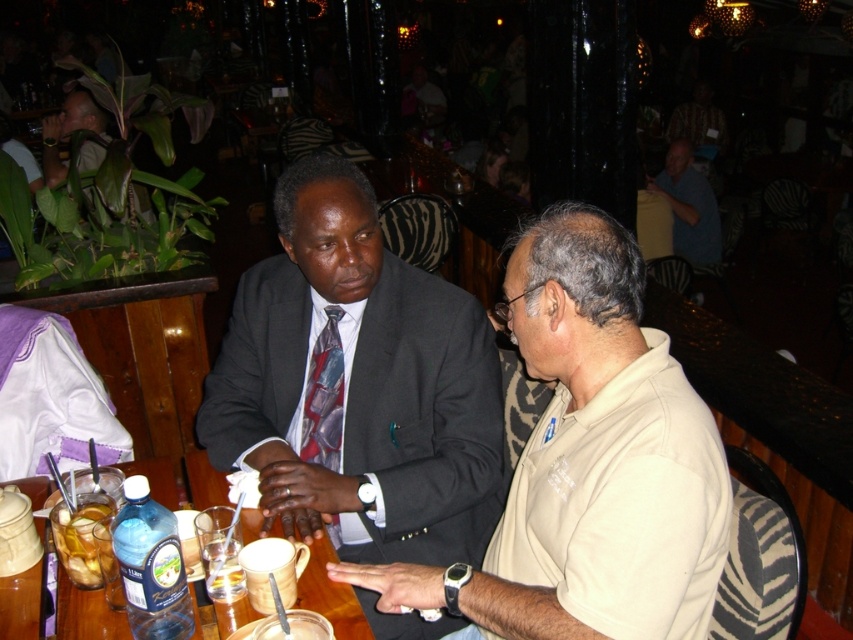
Question: Where is beige cotton shirt at center located in relation to translucent glass cup at lower left in the image?

Choices:
 (A) below
 (B) above

Answer: (B)

Question: Does translucent glass table at center have a smaller size compared to matte black suit at left?

Choices:
 (A) no
 (B) yes

Answer: (B)

Question: Based on their relative distances, which object is nearer to the translucent glass cup at lower left?

Choices:
 (A) matte black suit at left
 (B) beige cotton shirt at center
 (C) translucent glass table at center

Answer: (C)

Question: Among these objects, which one is farthest from the camera?

Choices:
 (A) shiny silk tie at center
 (B) translucent glass at table left
 (C) blue shirt at right

Answer: (C)

Question: Considering the real-world distances, which object is closest to the dark gray suit at center?

Choices:
 (A) translucent glass cup at lower left
 (B) blue shirt at right

Answer: (A)

Question: Does beige cotton shirt at center have a lesser width compared to translucent glass table at center?

Choices:
 (A) yes
 (B) no

Answer: (A)